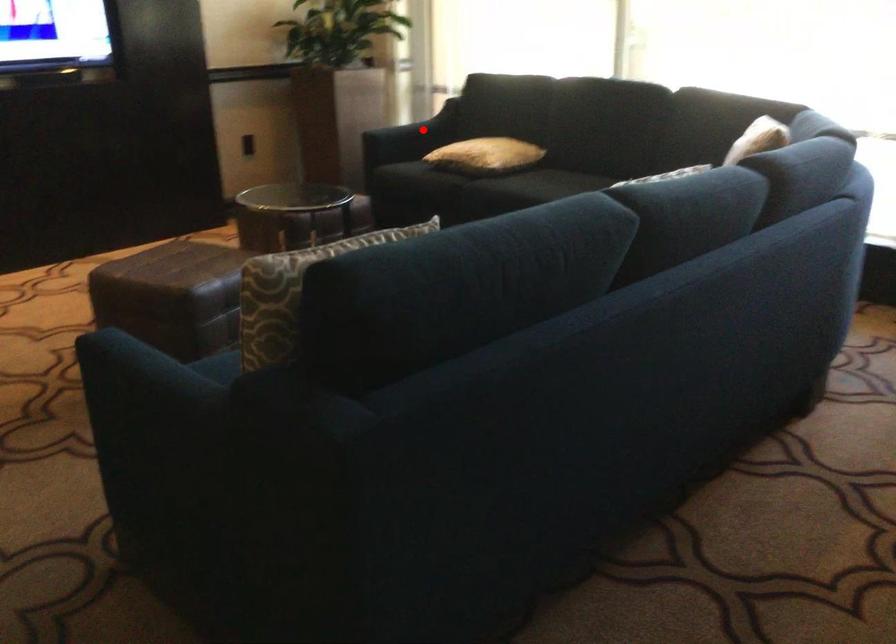
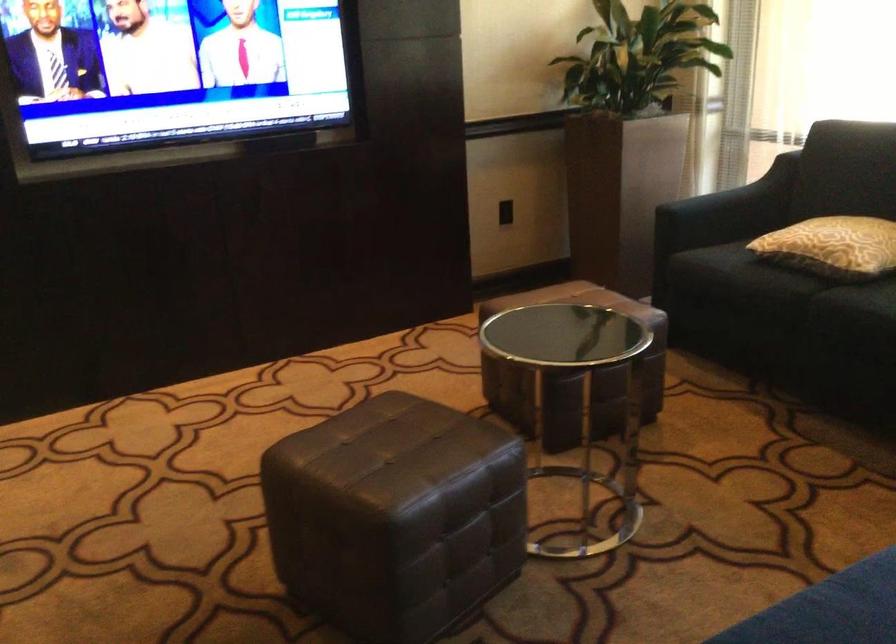
Question: A red point is marked in image1. In image2, is the corresponding 3D point closer to the camera or farther? Reply with the corresponding letter.

Choices:
 (A) The corresponding 3D point is closer.
 (B) The corresponding 3D point is farther.

Answer: (A)